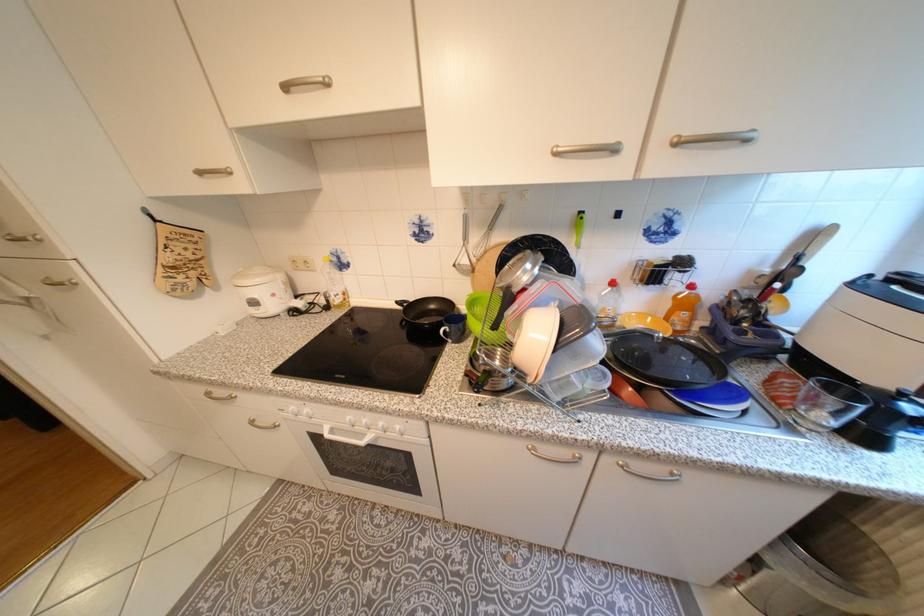
You are a GUI agent. You are given a task and a screenshot of the screen. Output one action in this format:
    pyautogui.click(x=<x>, y=<y>)
    Task: Click on the white oven handle
    This screenshot has width=924, height=616.
    Given the screenshot: What is the action you would take?
    pyautogui.click(x=348, y=438)